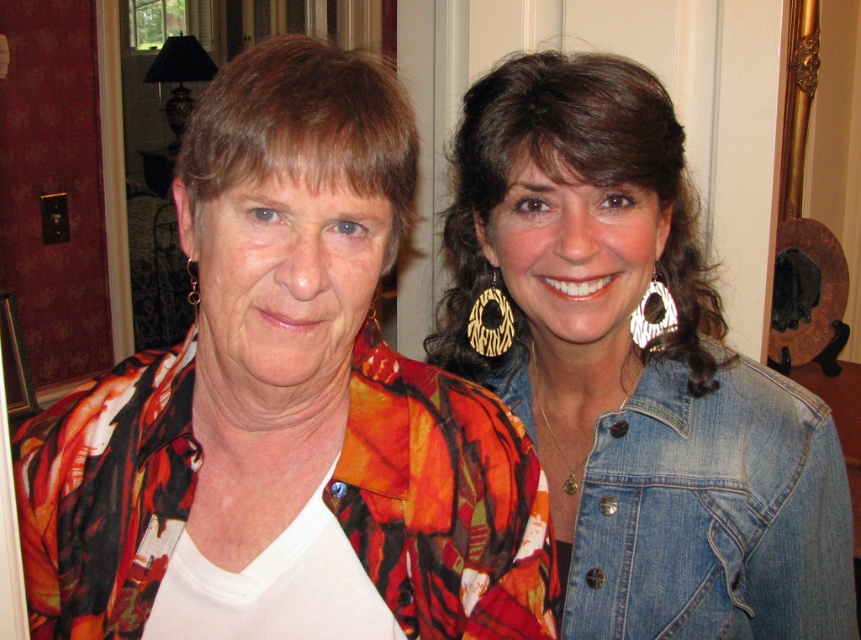
Is denim jacket at upper right thinner than faded denim jacket at lower right?

Incorrect, denim jacket at upper right's width is not less than faded denim jacket at lower right's.

Does denim jacket at upper right have a greater width compared to faded denim jacket at lower right?

Correct, the width of denim jacket at upper right exceeds that of faded denim jacket at lower right.

Is point (581, 547) behind point (748, 636)?

No, (581, 547) is in front of (748, 636).

Where is `denim jacket at upper right`? This screenshot has height=640, width=861. denim jacket at upper right is located at coordinates click(x=635, y=369).

Between printed fabric shirt at center and denim jacket at upper right, which one appears on the right side from the viewer's perspective?

From the viewer's perspective, denim jacket at upper right appears more on the right side.

The height and width of the screenshot is (640, 861). Describe the element at coordinates (285, 408) in the screenshot. I see `printed fabric shirt at center` at that location.

At what (x,y) coordinates should I click in order to perform the action: click on printed fabric shirt at center. Please return your answer as a coordinate pair (x, y). The height and width of the screenshot is (640, 861). Looking at the image, I should click on (285, 408).

How far apart are printed fabric shirt at center and gold textured earring at left?

printed fabric shirt at center and gold textured earring at left are 1.58 meters apart.

The height and width of the screenshot is (640, 861). What are the coordinates of `printed fabric shirt at center` in the screenshot? It's located at (285, 408).